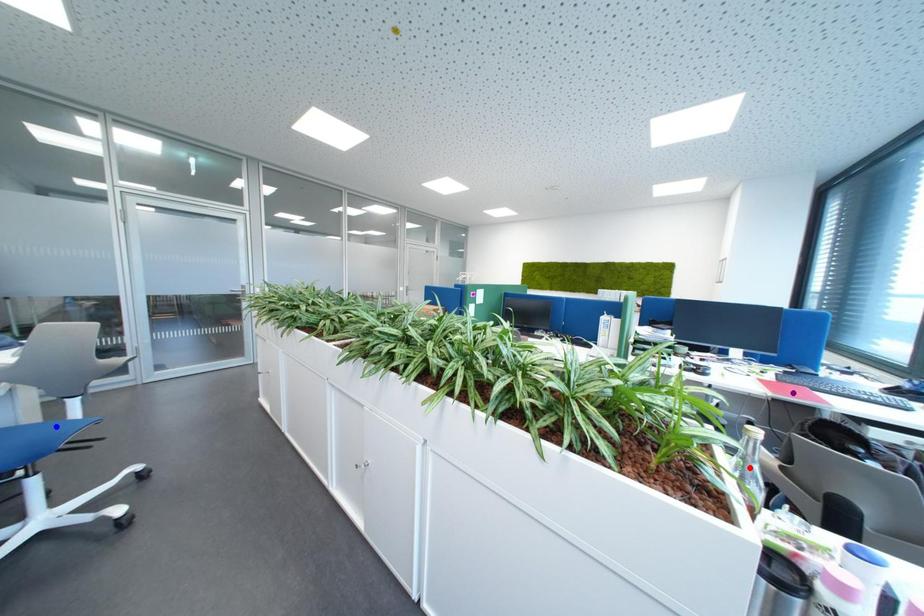
Order these from nearest to farthest:
1. red point
2. purple point
3. blue point

red point
blue point
purple point